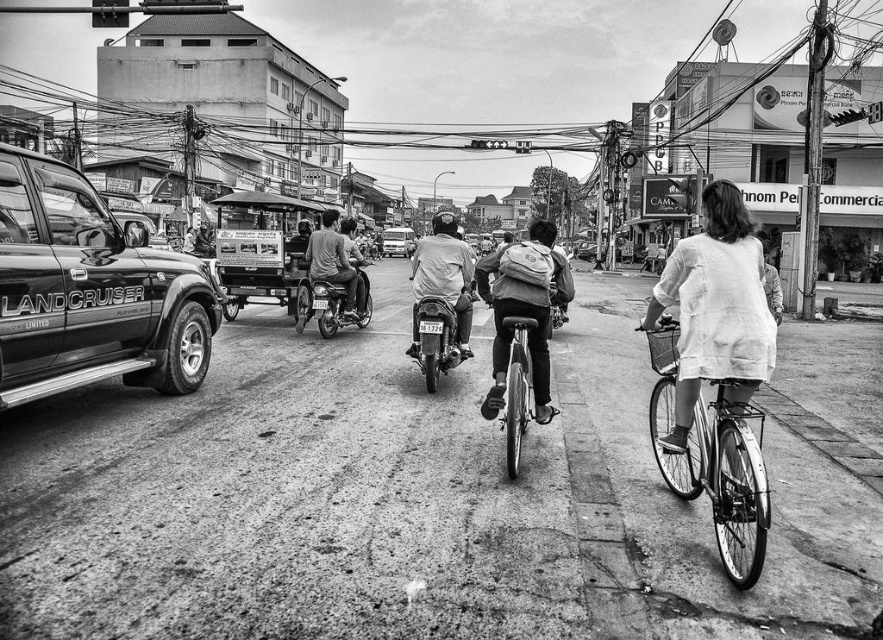
Is point (517, 316) positioned before point (391, 236)?

Yes, point (517, 316) is in front of point (391, 236).

Is metallic silver bicycle at center closer to camera compared to metallic silver van at center?

Yes, it is in front of metallic silver van at center.

Is point (503, 328) positioned before point (405, 248)?

Yes.

Locate an element on the screen. The width and height of the screenshot is (883, 640). metallic silver bicycle at center is located at coordinates (518, 385).

Is dark gray shirt at center smaller than metallic silver van at center?

Yes.

Who is positioned more to the left, dark gray shirt at center or metallic silver van at center?

metallic silver van at center

At what (x,y) coordinates should I click in order to perform the action: click on dark gray shirt at center. Please return your answer as a coordinate pair (x, y). Looking at the image, I should click on (334, 262).

Does white cotton shirt at right have a lesser width compared to light gray fabric shirt at center?

Correct, white cotton shirt at right's width is less than light gray fabric shirt at center's.

Is point (714, 221) positioned in front of point (436, 257)?

Yes, point (714, 221) is closer to viewer.

At what (x,y) coordinates should I click in order to perform the action: click on white cotton shirt at right. Please return your answer as a coordinate pair (x, y). Looking at the image, I should click on (715, 307).